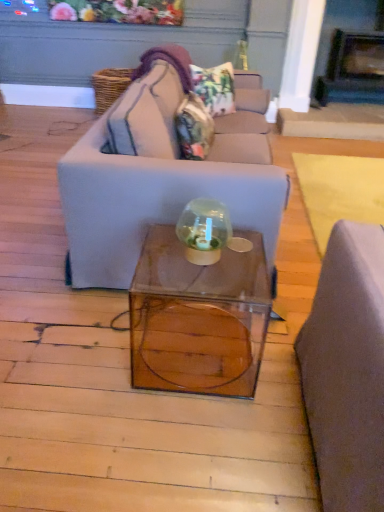
Question: From a real-world perspective, is transparent glass globe at center on top of matte gray couch at center?

Choices:
 (A) yes
 (B) no

Answer: (A)

Question: Does transparent glass globe at center have a greater width compared to matte gray couch at center?

Choices:
 (A) no
 (B) yes

Answer: (A)

Question: Is transparent glass globe at center outside of matte gray couch at center?

Choices:
 (A) yes
 (B) no

Answer: (A)

Question: Does transparent glass globe at center appear on the right side of matte gray couch at center?

Choices:
 (A) no
 (B) yes

Answer: (B)

Question: From the image's perspective, would you say transparent glass globe at center is shown under matte gray couch at center?

Choices:
 (A) yes
 (B) no

Answer: (A)

Question: Considering the relative sizes of transparent glass globe at center and matte gray couch at center in the image provided, is transparent glass globe at center smaller than matte gray couch at center?

Choices:
 (A) no
 (B) yes

Answer: (B)

Question: From the image's perspective, is dark gray stone fireplace at upper right beneath transparent glass globe at center?

Choices:
 (A) yes
 (B) no

Answer: (B)

Question: Considering the relative positions of dark gray stone fireplace at upper right and transparent glass globe at center in the image provided, is dark gray stone fireplace at upper right to the left of transparent glass globe at center from the viewer's perspective?

Choices:
 (A) yes
 (B) no

Answer: (B)

Question: From a real-world perspective, is dark gray stone fireplace at upper right positioned over transparent glass globe at center based on gravity?

Choices:
 (A) no
 (B) yes

Answer: (B)

Question: Considering the relative positions of dark gray stone fireplace at upper right and transparent glass globe at center in the image provided, is dark gray stone fireplace at upper right to the right of transparent glass globe at center from the viewer's perspective?

Choices:
 (A) yes
 (B) no

Answer: (A)

Question: Is the depth of dark gray stone fireplace at upper right greater than that of transparent glass globe at center?

Choices:
 (A) yes
 (B) no

Answer: (A)

Question: From a real-world perspective, does dark gray stone fireplace at upper right sit lower than transparent glass globe at center?

Choices:
 (A) yes
 (B) no

Answer: (B)

Question: Considering the relative sizes of matte gray couch at center and camouflage fabric pillow at center, the 1th pillow positioned from the bottom, in the image provided, is matte gray couch at center shorter than camouflage fabric pillow at center, the 1th pillow positioned from the bottom,?

Choices:
 (A) yes
 (B) no

Answer: (B)